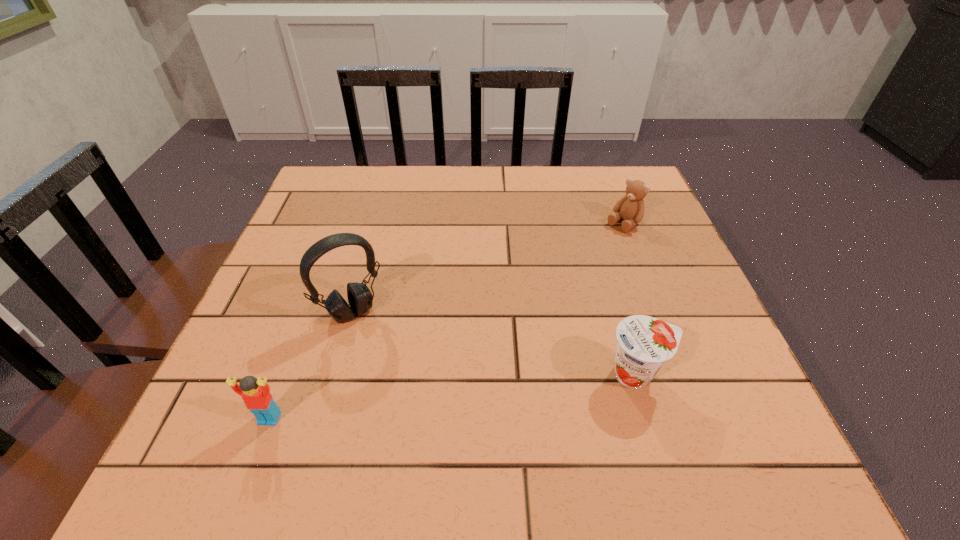
This screenshot has height=540, width=960. I want to click on free space located 0.110m on the front-facing side of the teddy bear, so click(588, 252).

Identify the location of object that is at the far edge. The image size is (960, 540). click(630, 208).

Image resolution: width=960 pixels, height=540 pixels. I want to click on Lego at the near edge, so click(x=255, y=393).

You are a GUI agent. You are given a task and a screenshot of the screen. Output one action in this format:
    pyautogui.click(x=<x>, y=<y>)
    Task: Click on the yogurt that is at the near edge
    
    Given the screenshot: What is the action you would take?
    pyautogui.click(x=644, y=344)

This screenshot has height=540, width=960. In order to click on Lego at the left edge in this screenshot , I will do `click(255, 393)`.

Locate an element on the screen. The image size is (960, 540). headset present at the left edge is located at coordinates click(360, 298).

Locate an element on the screen. The height and width of the screenshot is (540, 960). yogurt that is at the right edge is located at coordinates (644, 344).

At what (x,y) coordinates should I click in order to perform the action: click on teddy bear located at the right edge. Please return your answer as a coordinate pair (x, y). This screenshot has width=960, height=540. Looking at the image, I should click on (630, 208).

Find the location of `object located in the near left corner section of the desktop`. object located in the near left corner section of the desktop is located at coordinates (255, 393).

The height and width of the screenshot is (540, 960). Find the location of `object at the far right corner`. object at the far right corner is located at coordinates (630, 208).